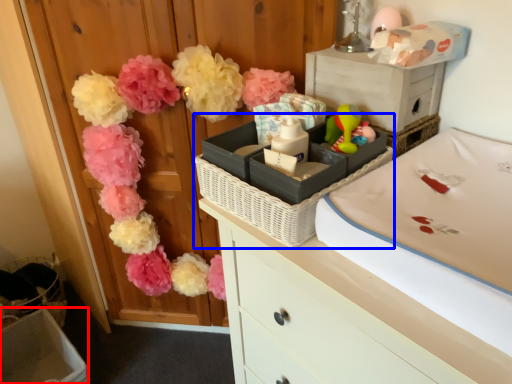
Question: Which point is closer to the camera, storage box (highlighted by a red box) or basket container (highlighted by a blue box)?

Choices:
 (A) storage box
 (B) basket container

Answer: (B)